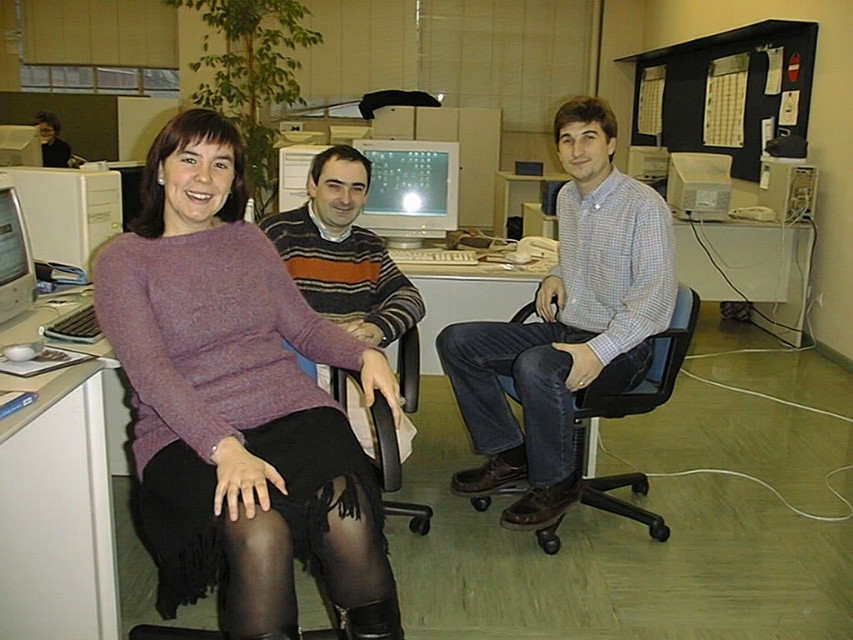
Based on the photo, is black tights at lower left positioned behind black mesh office chair at center?

No, black tights at lower left is in front of black mesh office chair at center.

Can you confirm if black tights at lower left is positioned to the left of black mesh office chair at center?

Correct, you'll find black tights at lower left to the left of black mesh office chair at center.

Does point (344, 563) come farther from viewer compared to point (679, 301)?

No, it is not.

At what (x,y) coordinates should I click in order to perform the action: click on black tights at lower left. Please return your answer as a coordinate pair (x, y). Image resolution: width=853 pixels, height=640 pixels. Looking at the image, I should click on (271, 531).

Is point (401, 304) in front of point (576, 445)?

Yes, it is in front of point (576, 445).

Find the location of a particular element. The height and width of the screenshot is (640, 853). striped sweater at center is located at coordinates (343, 252).

Which is more to the right, matte plastic monitor at center or matte white monitor at left?

From the viewer's perspective, matte plastic monitor at center appears more on the right side.

Between matte plastic monitor at center and matte white monitor at left, which one is positioned lower?

Positioned lower is matte white monitor at left.

Identify the location of matte plastic monitor at center. (410, 188).

Locate an element on the screen. This screenshot has width=853, height=640. matte plastic monitor at center is located at coordinates (410, 188).